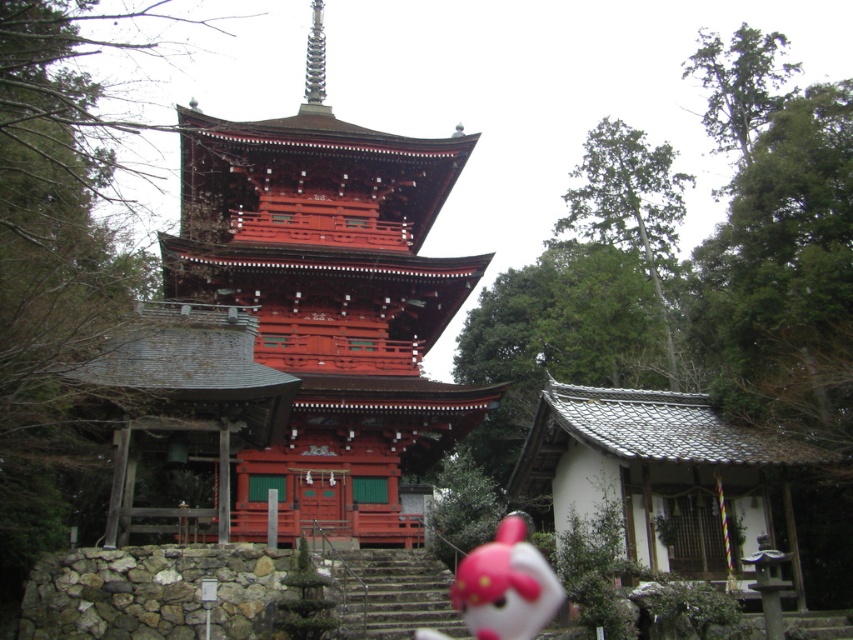
You are a visitor at the temple and want to take a photo of both the shiny lacquered pagoda at center and the matte pink plush toy at lower center. Which object should you focus on first if you want them both to be in the same frame without moving your camera?

You should focus on the shiny lacquered pagoda at center first because it is larger than the matte pink plush toy at lower center, so adjusting the camera to include the larger object will naturally include the smaller one as well.

You are standing at the entrance of the temple complex and want to reach the pagoda. There is a point marked at coordinates (390,593). What is located at this point that you should use to approach the pagoda?

The point at coordinates (390,593) corresponds to stone stairs at center, which you should use to approach the pagoda.

Consider the image. You are a tourist standing at the entrance of the temple complex and want to take a photo of the shiny lacquered pagoda at center and the stone stairs at center. Which object should you position to your right side to frame both in the shot?

The shiny lacquered pagoda at center is positioned on the left side of the stone stairs at center, so to frame both in the shot, you should position the stone stairs at center to your right side. This way, the pagoda will be on the left and the stairs on the right in your photo.